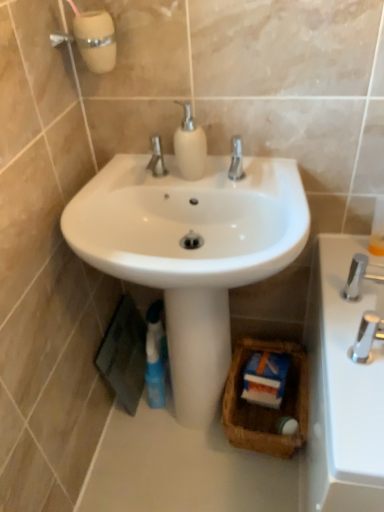
Question: Considering the positions of chrome metallic faucet at right, which is counted as the 1th tap, starting from the front, and brown woven basket at center in the image, is chrome metallic faucet at right, which is counted as the 1th tap, starting from the front, taller or shorter than brown woven basket at center?

Choices:
 (A) short
 (B) tall

Answer: (A)

Question: Relative to brown woven basket at center, is chrome metallic faucet at right, the second tap viewed from the back, in front or behind?

Choices:
 (A) front
 (B) behind

Answer: (A)

Question: Estimate the real-world distances between objects in this image. Which object is farther from the blue glossy mouthwash at lower center?

Choices:
 (A) white glossy sink at center
 (B) silver metallic tap at right, arranged as the 2th tap when viewed from the front
 (C) white matte soap dispenser at center
 (D) brown woven basket at center
 (E) chrome metallic faucet at right, the second tap viewed from the back

Answer: (E)

Question: Which of these objects is positioned farthest from the chrome metallic faucet at right, the second tap viewed from the back?

Choices:
 (A) blue glossy mouthwash at lower center
 (B) silver metallic tap at right, which is counted as the 1th tap, starting from the back
 (C) white glossy sink at center
 (D) brown woven basket at center
 (E) white matte soap dispenser at center

Answer: (A)